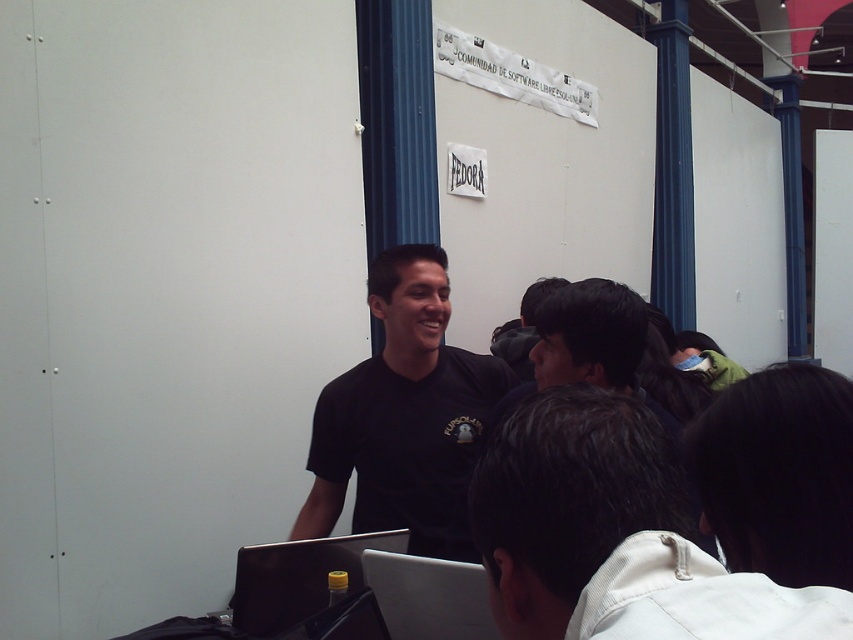
Question: Can you confirm if white corduroy jacket at lower right is bigger than black hair at lower right?

Choices:
 (A) yes
 (B) no

Answer: (A)

Question: Can you confirm if black hair at lower right is wider than silver metallic laptop at lower left?

Choices:
 (A) yes
 (B) no

Answer: (B)

Question: Which object is the farthest from the silver metallic laptop at center?

Choices:
 (A) white corduroy jacket at lower right
 (B) silver metallic laptop at lower left

Answer: (A)

Question: Does white corduroy jacket at lower right have a lesser width compared to black matte shirt at center?

Choices:
 (A) yes
 (B) no

Answer: (A)

Question: Which of the following is the farthest from the observer?

Choices:
 (A) silver metallic laptop at center
 (B) silver metallic laptop at lower left
 (C) white corduroy jacket at lower right
 (D) black matte shirt at center

Answer: (D)

Question: Which of the following is the farthest from the observer?

Choices:
 (A) white corduroy jacket at lower right
 (B) silver metallic laptop at lower left
 (C) black matte shirt at center

Answer: (C)